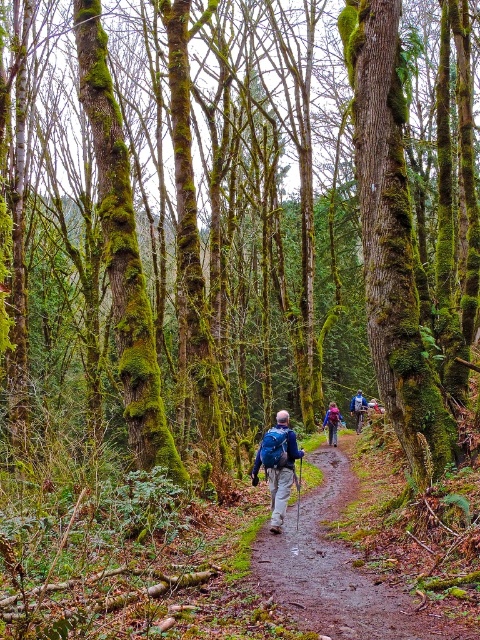
Question: Can you confirm if green mossy tree at center is bigger than blue fabric backpack at center?

Choices:
 (A) no
 (B) yes

Answer: (A)

Question: Can you confirm if matte blue backpack at center is positioned to the right of matte purple backpack at center?

Choices:
 (A) yes
 (B) no

Answer: (B)

Question: Which of the following is the farthest from the observer?

Choices:
 (A) matte purple backpack at center
 (B) damp dirt path at center
 (C) blue fabric backpack at center

Answer: (C)

Question: Does green mossy tree at center lie behind matte blue backpack at center?

Choices:
 (A) no
 (B) yes

Answer: (A)

Question: Which object is positioned closest to the matte purple backpack at center?

Choices:
 (A) matte blue backpack at center
 (B) green mossy tree at center

Answer: (A)

Question: Which of the following is the closest to the observer?

Choices:
 (A) (410, 460)
 (B) (362, 406)
 (C) (275, 461)

Answer: (A)